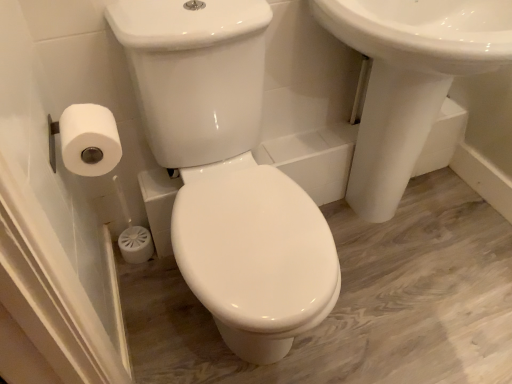
Question: Does white glossy toilet at center have a greater width compared to white glossy sink at upper right?

Choices:
 (A) yes
 (B) no

Answer: (A)

Question: Does white glossy toilet at center lie in front of white glossy sink at upper right?

Choices:
 (A) yes
 (B) no

Answer: (A)

Question: From the image's perspective, does white glossy toilet at center appear higher than white glossy sink at upper right?

Choices:
 (A) no
 (B) yes

Answer: (A)

Question: Is white glossy toilet at center thinner than white glossy sink at upper right?

Choices:
 (A) no
 (B) yes

Answer: (A)

Question: Would you say white glossy toilet at center contains white glossy sink at upper right?

Choices:
 (A) yes
 (B) no

Answer: (B)

Question: From a real-world perspective, is white glossy toilet at center over white glossy sink at upper right?

Choices:
 (A) no
 (B) yes

Answer: (A)

Question: From a real-world perspective, does white glossy sink at upper right sit lower than white matte toilet paper at left?

Choices:
 (A) yes
 (B) no

Answer: (A)

Question: Does white glossy sink at upper right turn towards white matte toilet paper at left?

Choices:
 (A) yes
 (B) no

Answer: (B)

Question: Can white matte toilet paper at left be found inside white glossy sink at upper right?

Choices:
 (A) yes
 (B) no

Answer: (B)

Question: Considering the relative sizes of white glossy sink at upper right and white matte toilet paper at left in the image provided, is white glossy sink at upper right shorter than white matte toilet paper at left?

Choices:
 (A) no
 (B) yes

Answer: (A)

Question: Is white glossy sink at upper right not close to white matte toilet paper at left?

Choices:
 (A) no
 (B) yes

Answer: (A)

Question: From the image's perspective, is white glossy sink at upper right located above white matte toilet paper at left?

Choices:
 (A) yes
 (B) no

Answer: (A)

Question: Is white glossy toilet at center next to white matte toilet paper at left?

Choices:
 (A) yes
 (B) no

Answer: (B)